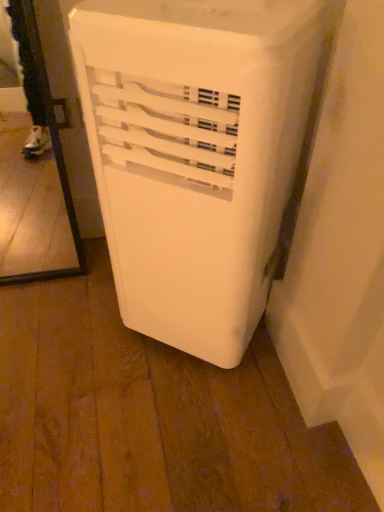
The width and height of the screenshot is (384, 512). Find the location of `white plastic air conditioner at lower right`. white plastic air conditioner at lower right is located at coordinates (195, 154).

What do you see at coordinates (195, 154) in the screenshot? The width and height of the screenshot is (384, 512). I see `white plastic air conditioner at lower right` at bounding box center [195, 154].

Identify the location of white plastic air conditioner at lower right. Image resolution: width=384 pixels, height=512 pixels. (195, 154).